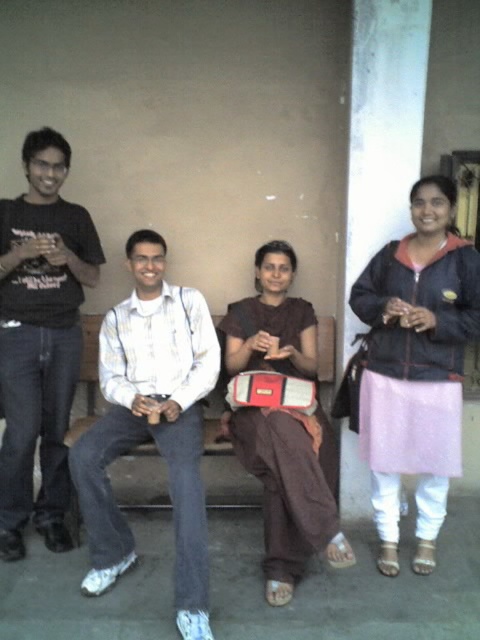
You are standing in the waiting area and want to hand a document to the person wearing the white striped shirt at center. If your arm can reach 2 meters, can you reach them without moving?

The white striped shirt at center is 2.15 meters away from the viewer. Since your arm can only reach 2 meters, you cannot reach them without moving closer.

You are observing two people in the scene. The first is wearing a black matte shirt at left, and the second is wearing a white striped shirt at center. Which person is shorter in height?

The white striped shirt at center is shorter than the black matte shirt at left, so the person wearing the white striped shirt at center is shorter.

You are a delivery person who needs to place a small package between the pink fabric skirt at right and the white striped shirt at center. Can you fit the package in the space between them?

The distance between the pink fabric skirt at right and the white striped shirt at center is 34.79 inches, so yes, the package can be placed between them as the space is sufficient.